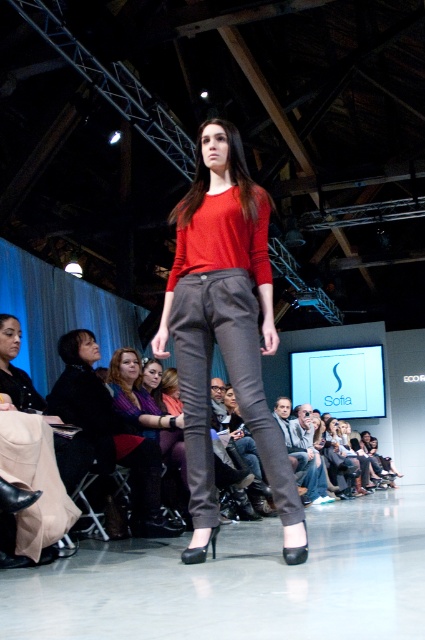
Does matte red sweater at center appear over matte black pants at center?

Yes.

Can you confirm if matte red sweater at center is thinner than matte black pants at center?

Indeed, matte red sweater at center has a lesser width compared to matte black pants at center.

Between point (164, 339) and point (150, 472), which one is positioned in front?

Point (164, 339) is in front.

You are a GUI agent. You are given a task and a screenshot of the screen. Output one action in this format:
    pyautogui.click(x=<x>, y=<y>)
    Task: Click on the matte red sweater at center
    
    Given the screenshot: What is the action you would take?
    pyautogui.click(x=224, y=326)

Does matte red sweater at center appear on the left side of matte purple sweater at center?

In fact, matte red sweater at center is to the right of matte purple sweater at center.

This screenshot has width=425, height=640. Identify the location of matte red sweater at center. (224, 326).

You are a GUI agent. You are given a task and a screenshot of the screen. Output one action in this format:
    pyautogui.click(x=<x>, y=<y>)
    Task: Click on the matte red sweater at center
    This screenshot has width=425, height=640.
    Given the screenshot: What is the action you would take?
    pyautogui.click(x=224, y=326)

From the picture: Can you confirm if matte black pants at center is wider than matte purple sweater at center?

Yes.

Does point (95, 392) come closer to viewer compared to point (170, 413)?

That is True.

Identify the location of matte black pants at center. This screenshot has height=640, width=425. (108, 429).